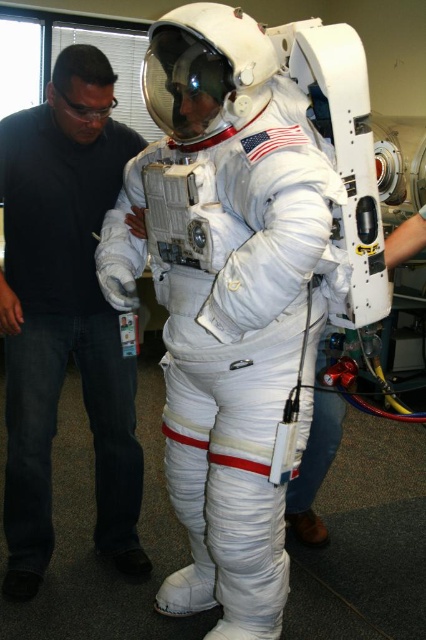
Based on the coordinates provided, which object is located at point (63, 333) in the scene?

The point (63, 333) corresponds to the white matte astronaut suit at center.

You are designing a storage locker for equipment. The locker has a compartment that can only fit items narrower than the white matte astronaut suit at center. Can the clear plastic goggles at upper left fit in the compartment?

The white matte astronaut suit at center might be wider than clear plastic goggles at upper left, so the goggles could potentially fit in the compartment if the locker is designed to accommodate items narrower than the suit.